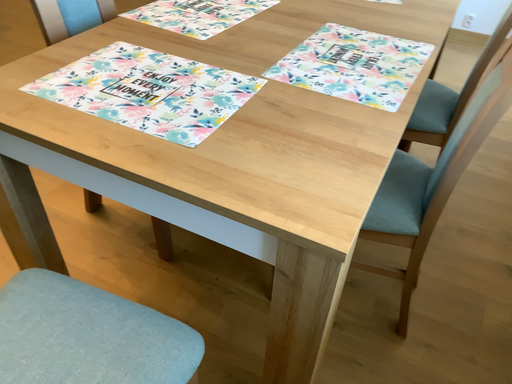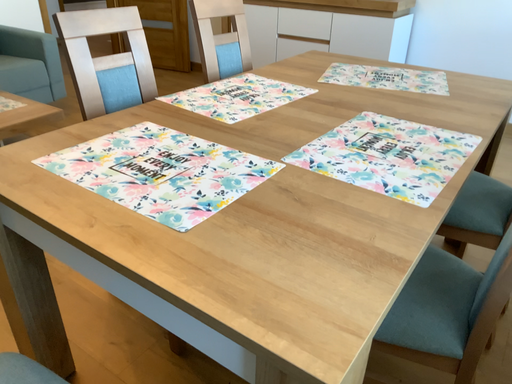
Question: How did the camera likely rotate when shooting the video?

Choices:
 (A) rotated upward
 (B) rotated downward

Answer: (A)